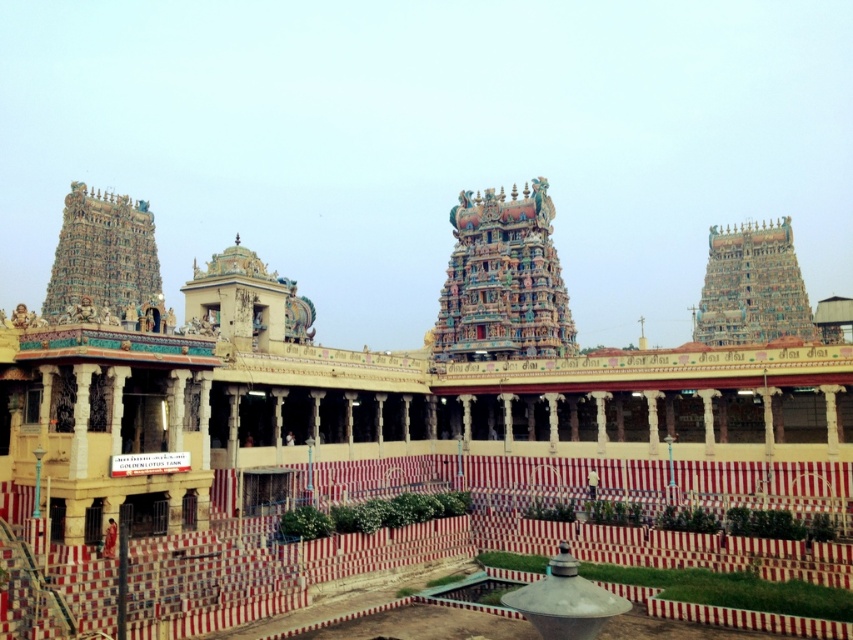
You are a tourist standing in the courtyard of the multicolored ornate temple at center. You want to take a photo of the multicolored carved temple tower at upper left. Which direction should you face to capture it in your photo?

Result: You should face towards the upper left direction to capture the multicolored carved temple tower at upper left in your photo since it is located at the upper left of the multicolored ornate temple at center.

You are standing in the grand temple complex and want to move from point (556, 304) to point (503, 262). Which direction should you move to get closer to your destination?

Since point (556, 304) is further to the viewer than point (503, 262), you should move forward towards the temple complex to reach your destination.

You are an architect visiting the temple complex and need to determine which structure is bigger in size between the yellow painted stone palace at center and the multicolored ornate temple tower at upper right. Based on the scene, which one is larger?

The yellow painted stone palace at center has a larger size compared to the multicolored ornate temple tower at upper right, so the yellow painted stone palace at center is bigger.